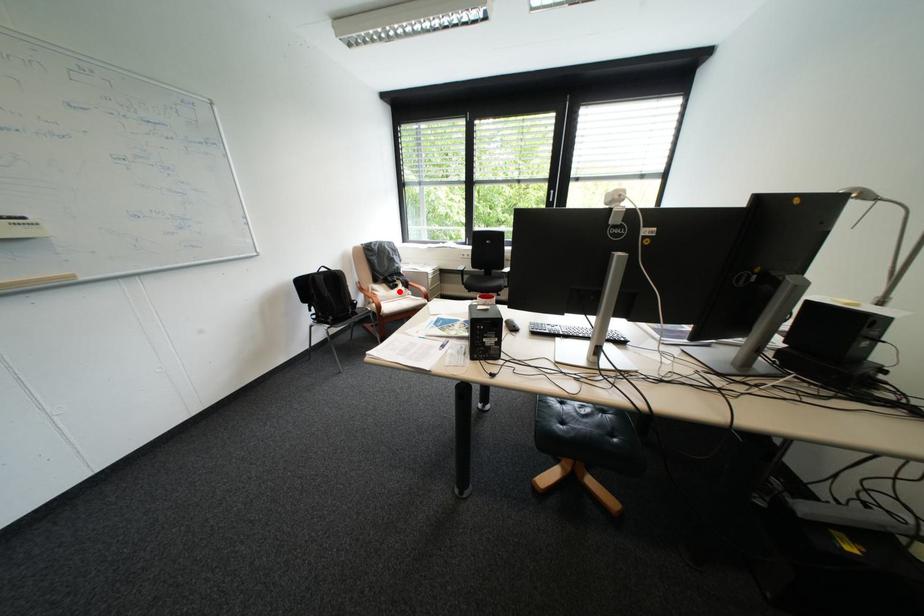
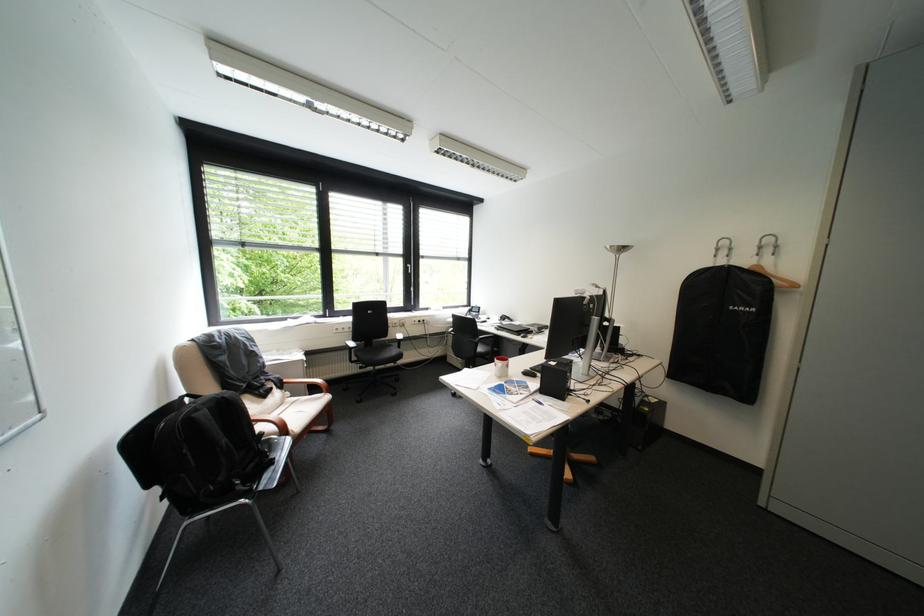
In the second image, find the point that corresponds to the highlighted location in the first image.

(272, 403)